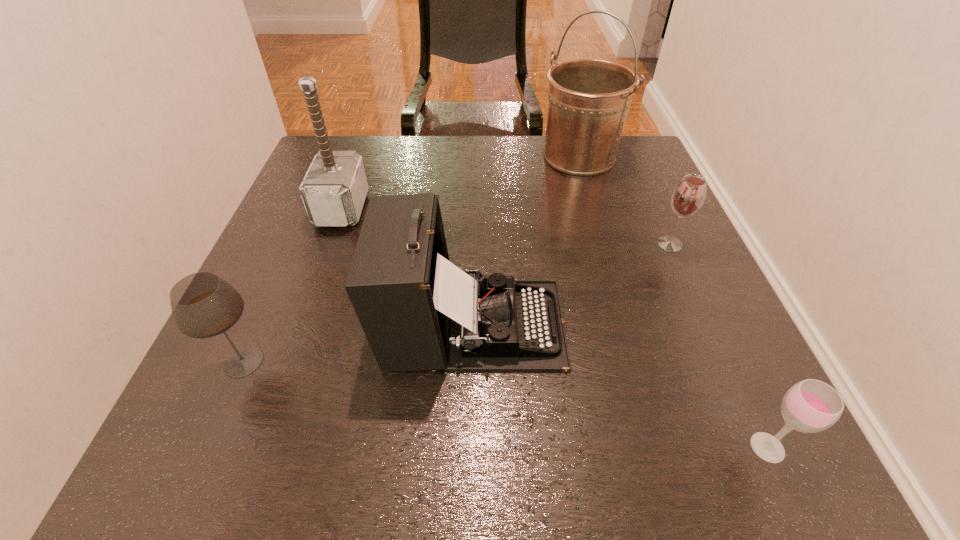
Where is `vacant space located 0.060m for striking with the head of the second tallest object`? This screenshot has width=960, height=540. vacant space located 0.060m for striking with the head of the second tallest object is located at coordinates (391, 208).

Identify the location of vacant area situated inside the open case of the typewriter. (712, 323).

Image resolution: width=960 pixels, height=540 pixels. Find the location of `vacant area located 0.210m on the back of the second farthest wineglass`. vacant area located 0.210m on the back of the second farthest wineglass is located at coordinates (289, 258).

You are a GUI agent. You are given a task and a screenshot of the screen. Output one action in this format:
    pyautogui.click(x=<x>, y=<y>)
    Task: Click on the free space located 0.240m on the back of the farthest wineglass
    
    Given the screenshot: What is the action you would take?
    pyautogui.click(x=638, y=175)

Where is `free space located on the back of the nearest object`? The width and height of the screenshot is (960, 540). free space located on the back of the nearest object is located at coordinates (684, 266).

Image resolution: width=960 pixels, height=540 pixels. In order to click on object that is positioned at the far edge in this screenshot , I will do `click(588, 99)`.

Identify the location of object located in the near edge section of the desktop. tap(810, 406).

Find the location of a particular element. Image resolution: width=960 pixels, height=540 pixels. hammer that is at the left edge is located at coordinates (334, 189).

At what (x,y) coordinates should I click in order to perform the action: click on wineglass located at the left edge. Please return your answer as a coordinate pair (x, y). This screenshot has width=960, height=540. Looking at the image, I should click on click(x=203, y=305).

At what (x,y) coordinates should I click in order to perform the action: click on bucket present at the right edge. Please return your answer as a coordinate pair (x, y). Image resolution: width=960 pixels, height=540 pixels. Looking at the image, I should click on (588, 99).